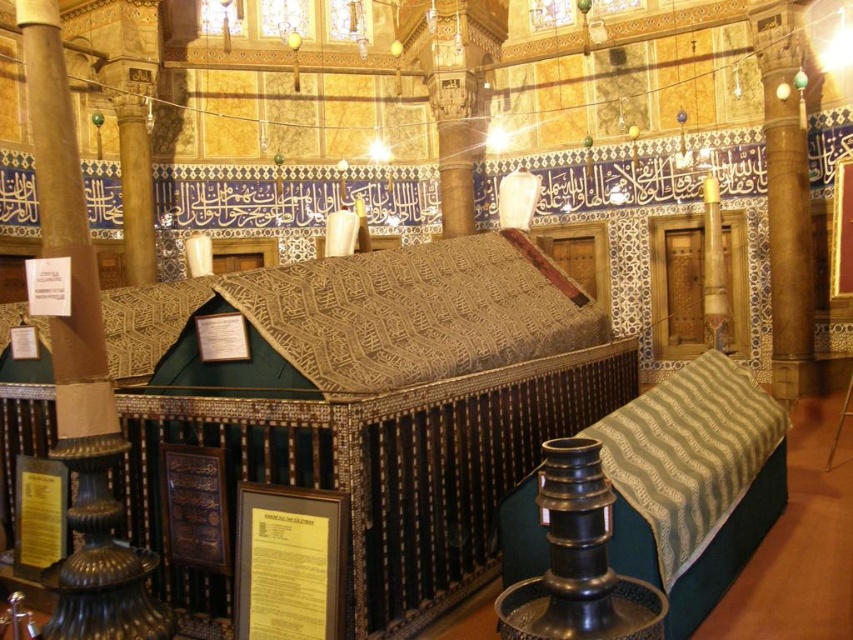
Consider the image. You are standing at point [764,150] and want to reach the large rectangular structure in the center. Given that the distance between you and the structure is 42.47 meters, can you walk directly to it without any obstacles?

The distance between you and the large rectangular structure in the center is 42.47 meters. Since there are no obstacles mentioned in the scene description, you can walk directly to it.

You are an interior designer planning to place a large sculpture in this room. You need to choose between placing it near the polished marble pillar at center or the wooden column at right. Based on their sizes, which location would allow for more space around the sculpture?

The wooden column at right occupies more space than the polished marble pillar at center, so placing the sculpture near the polished marble pillar at center would allow for more space around it.